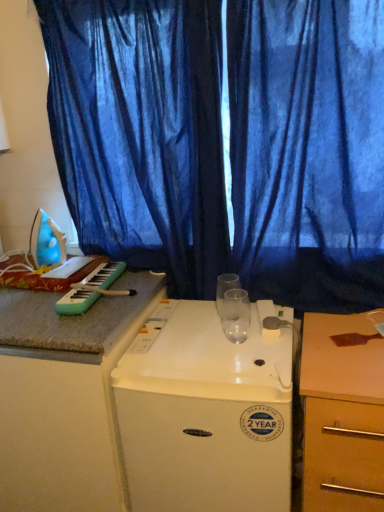
How much space does blue fabric curtain at center, marked as the second curtain in a left-to-right arrangement, occupy vertically?

blue fabric curtain at center, marked as the second curtain in a left-to-right arrangement, is 1.11 meters in height.

The height and width of the screenshot is (512, 384). What do you see at coordinates (46, 242) in the screenshot?
I see `blue plastic iron at left` at bounding box center [46, 242].

Find the location of a particular element. The width and height of the screenshot is (384, 512). green plastic keyboard at left is located at coordinates [x=76, y=301].

Image resolution: width=384 pixels, height=512 pixels. What do you see at coordinates (76, 301) in the screenshot?
I see `green plastic keyboard at left` at bounding box center [76, 301].

Where is `blue sheer curtain at upper center, the second curtain positioned from the right`? This screenshot has width=384, height=512. blue sheer curtain at upper center, the second curtain positioned from the right is located at coordinates (222, 141).

Between blue fabric curtain at center, marked as the 1th curtain in a right-to-left arrangement, and blue sheer curtain at upper center, which ranks as the first curtain in left-to-right order, which one has less height?

blue sheer curtain at upper center, which ranks as the first curtain in left-to-right order.

From a real-world perspective, between blue fabric curtain at center, marked as the second curtain in a left-to-right arrangement, and blue sheer curtain at upper center, the second curtain positioned from the right, who is vertically higher?

In real-world perspective, blue sheer curtain at upper center, the second curtain positioned from the right, is above.

Does point (43, 257) lie behind point (175, 287)?

Yes, point (43, 257) is behind point (175, 287).

Looking at this image, does blue plastic iron at left appear on the left side of blue sheer curtain at upper center, which ranks as the first curtain in left-to-right order?

Yes, blue plastic iron at left is to the left of blue sheer curtain at upper center, which ranks as the first curtain in left-to-right order.

Would you say blue plastic iron at left is outside blue sheer curtain at upper center, the second curtain positioned from the right?

blue plastic iron at left is positioned outside blue sheer curtain at upper center, the second curtain positioned from the right.

Are blue plastic iron at left and blue sheer curtain at upper center, the second curtain positioned from the right, beside each other?

blue plastic iron at left is not next to blue sheer curtain at upper center, the second curtain positioned from the right, and they're not touching.

Consider the image. Which point is more forward, (311, 370) or (102, 268)?

The point (311, 370) is closer to the camera.

Considering the relative positions of wooden at right and green plastic keyboard at left in the image provided, is wooden at right to the right of green plastic keyboard at left from the viewer's perspective?

Indeed, wooden at right is positioned on the right side of green plastic keyboard at left.

From the image's perspective, between wooden at right and green plastic keyboard at left, which one is located above?

green plastic keyboard at left appears higher in the image.

Is point (293, 95) farther from camera compared to point (62, 242)?

No, it is not.

Considering the relative sizes of blue fabric curtain at center, marked as the second curtain in a left-to-right arrangement, and blue plastic iron at left in the image provided, is blue fabric curtain at center, marked as the second curtain in a left-to-right arrangement, taller than blue plastic iron at left?

Yes.

Is blue fabric curtain at center, marked as the 1th curtain in a right-to-left arrangement, positioned behind blue plastic iron at left?

No, it is not.

Is blue fabric curtain at center, marked as the 1th curtain in a right-to-left arrangement, not near blue plastic iron at left?

No, blue fabric curtain at center, marked as the 1th curtain in a right-to-left arrangement, is in close proximity to blue plastic iron at left.

Which point is more forward, (182, 337) or (93, 278)?

The point (182, 337) is more forward.

Which of these two, white plastic refrigerator at center or green plastic keyboard at left, is wider?

Wider between the two is white plastic refrigerator at center.

From the image's perspective, does white plastic refrigerator at center appear lower than green plastic keyboard at left?

Correct, white plastic refrigerator at center appears lower than green plastic keyboard at left in the image.

Looking at this image, considering the positions of objects wooden at right and white plastic refrigerator at center in the image provided, who is more to the right, wooden at right or white plastic refrigerator at center?

wooden at right is more to the right.

Is wooden at right further to the viewer compared to white plastic refrigerator at center?

No, wooden at right is closer to the viewer.

Considering the relative sizes of wooden at right and white plastic refrigerator at center in the image provided, is wooden at right thinner than white plastic refrigerator at center?

Yes.

Consider the image. Would you say wooden at right is a long distance from white plastic refrigerator at center?

wooden at right is actually quite close to white plastic refrigerator at center.

In terms of height, does green plastic keyboard at left look taller or shorter compared to white plastic refrigerator at center?

green plastic keyboard at left is shorter than white plastic refrigerator at center.

Is green plastic keyboard at left placed right next to white plastic refrigerator at center?

green plastic keyboard at left and white plastic refrigerator at center are not in contact.

Is green plastic keyboard at left outside of white plastic refrigerator at center?

green plastic keyboard at left is positioned outside white plastic refrigerator at center.

You are a GUI agent. You are given a task and a screenshot of the screen. Output one action in this format:
    pyautogui.click(x=<x>, y=<y>)
    Task: Click on the curtain below the blue sheer curtain at upper center, which ranks as the first curtain in left-to-right order (from the image's perspective)
    
    Given the screenshot: What is the action you would take?
    pyautogui.click(x=308, y=151)

I want to click on the 1st curtain in front when counting from the blue plastic iron at left, so click(x=222, y=141).

Estimate the real-world distances between objects in this image. Which object is closer to blue plastic iron at left, green plastic keyboard at left or wooden at right?

green plastic keyboard at left is positioned closer to the anchor blue plastic iron at left.

When comparing their distances from wooden at right, does green plastic keyboard at left or blue sheer curtain at upper center, which ranks as the first curtain in left-to-right order, seem further?

green plastic keyboard at left is positioned further to the anchor wooden at right.

Considering their positions, is wooden at right positioned further to white plastic refrigerator at center than blue fabric curtain at center, marked as the second curtain in a left-to-right arrangement?

blue fabric curtain at center, marked as the second curtain in a left-to-right arrangement, is further to white plastic refrigerator at center.

Which object lies nearer to the anchor point blue fabric curtain at center, marked as the second curtain in a left-to-right arrangement, green plastic keyboard at left or blue sheer curtain at upper center, which ranks as the first curtain in left-to-right order?

Based on the image, blue sheer curtain at upper center, which ranks as the first curtain in left-to-right order, appears to be nearer to blue fabric curtain at center, marked as the second curtain in a left-to-right arrangement.

From the image, which object appears to be farther from green plastic keyboard at left, blue plastic iron at left or wooden at right?

wooden at right is further to green plastic keyboard at left.

Estimate the real-world distances between objects in this image. Which object is closer to blue fabric curtain at center, marked as the second curtain in a left-to-right arrangement, blue plastic iron at left or wooden at right?

Based on the image, wooden at right appears to be nearer to blue fabric curtain at center, marked as the second curtain in a left-to-right arrangement.

Estimate the real-world distances between objects in this image. Which object is further from wooden at right, blue sheer curtain at upper center, the second curtain positioned from the right, or green plastic keyboard at left?

green plastic keyboard at left.

From the image, which object appears to be farther from blue plastic iron at left, blue sheer curtain at upper center, which ranks as the first curtain in left-to-right order, or wooden at right?

wooden at right.

In order to click on home appliance situated between blue plastic iron at left and wooden at right from left to right in this screenshot , I will do `click(205, 414)`.

At what (x,y) coordinates should I click in order to perform the action: click on appliance that lies between blue sheer curtain at upper center, the second curtain positioned from the right, and wooden at right from top to bottom. Please return your answer as a coordinate pair (x, y). Looking at the image, I should click on (46, 242).

You are a GUI agent. You are given a task and a screenshot of the screen. Output one action in this format:
    pyautogui.click(x=<x>, y=<y>)
    Task: Click on the appliance between blue sheer curtain at upper center, which ranks as the first curtain in left-to-right order, and white plastic refrigerator at center vertically
    This screenshot has width=384, height=512.
    Given the screenshot: What is the action you would take?
    pyautogui.click(x=46, y=242)

Locate an element on the screen. This screenshot has width=384, height=512. musical keyboard between blue plastic iron at left and blue fabric curtain at center, marked as the 1th curtain in a right-to-left arrangement, from left to right is located at coordinates (76, 301).